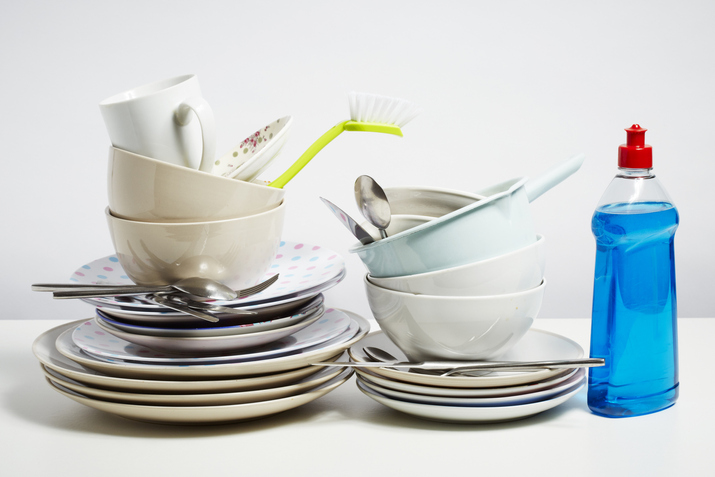
The width and height of the screenshot is (715, 477). Find the location of `silverware`. silverware is located at coordinates (41, 284), (56, 292), (177, 302), (375, 364), (379, 354), (347, 222), (382, 201).